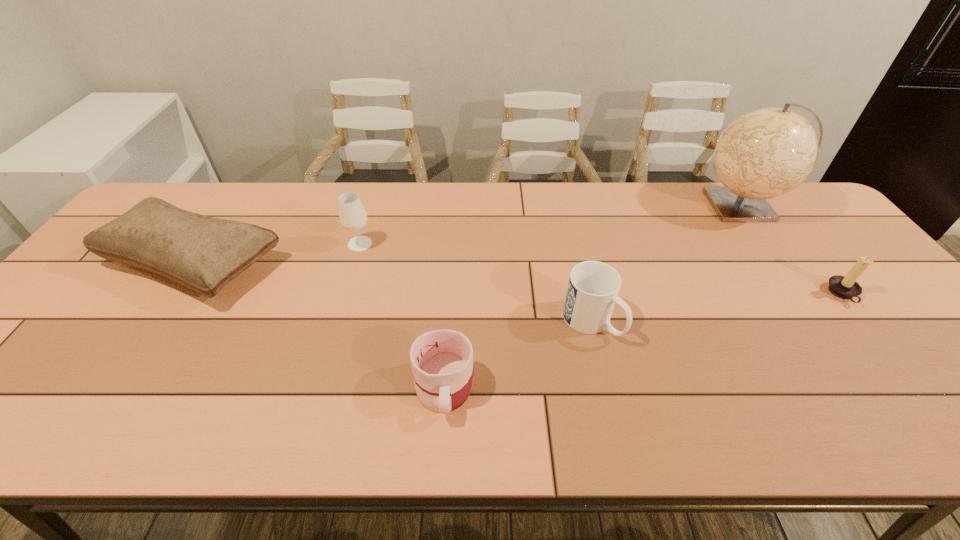
This screenshot has height=540, width=960. In order to click on free space located on the surface of the globe showing Europe and Africa in this screenshot , I will do [632, 206].

You are a GUI agent. You are given a task and a screenshot of the screen. Output one action in this format:
    pyautogui.click(x=<x>, y=<y>)
    Task: Click on the free space located 0.150m on the left of the fifth object from right to left
    Image resolution: width=960 pixels, height=540 pixels.
    Given the screenshot: What is the action you would take?
    [x=296, y=244]

Image resolution: width=960 pixels, height=540 pixels. I want to click on vacant space located on the front of the leftmost object, so click(x=81, y=431).

Identify the location of vacant space situated 0.220m on the front of the taller mug. (617, 437).

The image size is (960, 540). What are the coordinates of `free space located on the wick of the candle holder` in the screenshot? It's located at (702, 294).

Locate an element on the screen. This screenshot has height=540, width=960. free space located 0.280m on the wick of the candle holder is located at coordinates (721, 294).

Where is `free region located 0.290m on the wick of the candle holder`? free region located 0.290m on the wick of the candle holder is located at coordinates (717, 294).

Where is `globe located in the far edge section of the desktop`? globe located in the far edge section of the desktop is located at coordinates (768, 152).

Where is `cushion that is at the far edge`? cushion that is at the far edge is located at coordinates (203, 253).

Find the location of `object present at the near edge`. object present at the near edge is located at coordinates (442, 360).